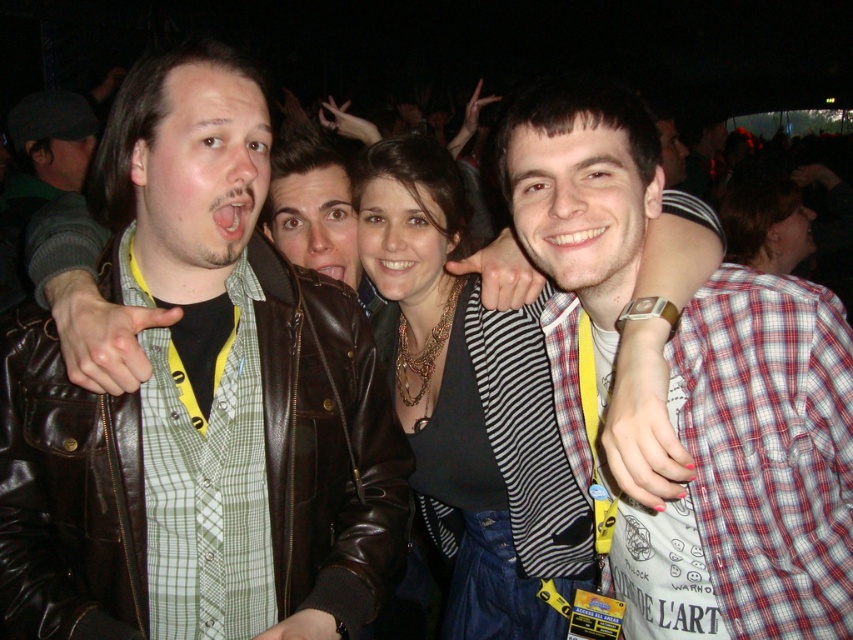
You are a photographer at the event and need to adjust the lighting to ensure both the matte brown leather jacket at left and the matte black top at center are well lit. Since the scene is dimly lit, which object should you focus more light on to ensure visibility?

The matte brown leather jacket at left is located above the matte black top at center. Since the matte brown leather jacket is higher up, you should focus more light on the matte black top at center to ensure it is visible, as it might be in a shadowed area below.

You are a photographer standing at the event and want to take a closeup shot of the matte brown leather jacket at left. The camera you have can focus on objects within 1 meter. Will the jacket be in focus?

The matte brown leather jacket at left is 1.09 meters away from viewer, so it is slightly out of the camera focus range. The camera can only focus within 1 meter, so the jacket will not be in focus.

You are standing in front of the group at the party. You want to move closer to both the point at location (184, 417) and the point at location (430, 380). Which point should you move towards first to reach the closer one?

You should move towards point (184, 417) first because it is closer to you than point (430, 380).